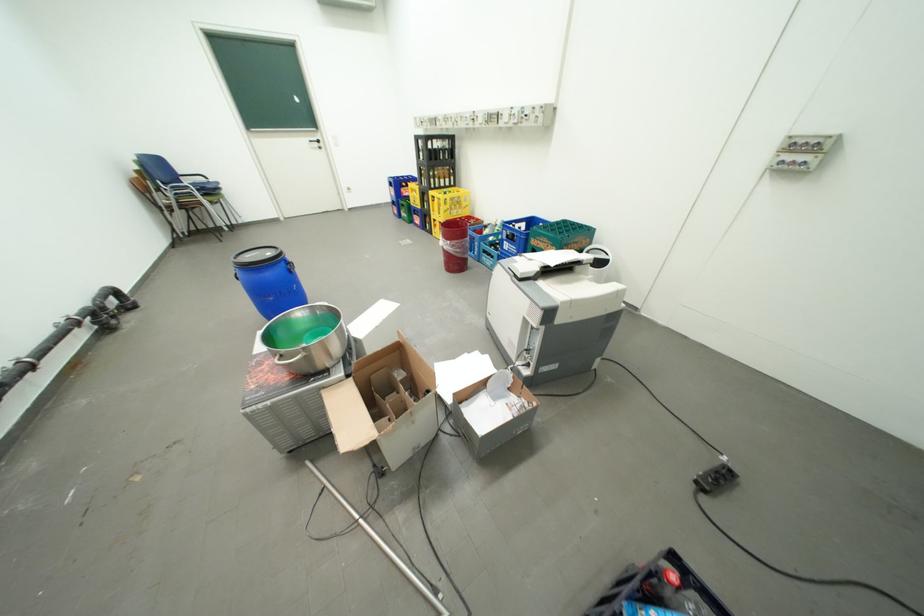
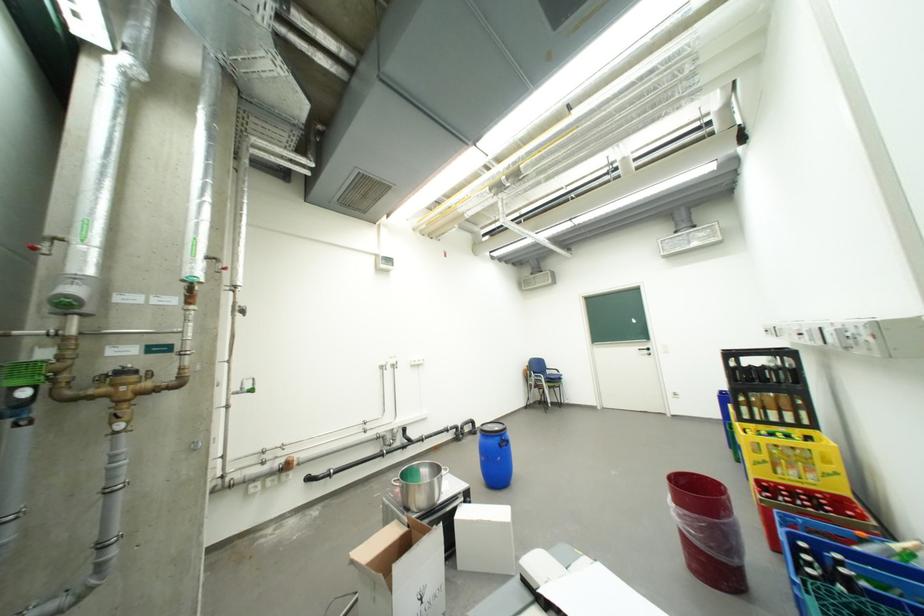
In the second image, find the point that corresponds to the point at 459,243 in the first image.

(685, 507)